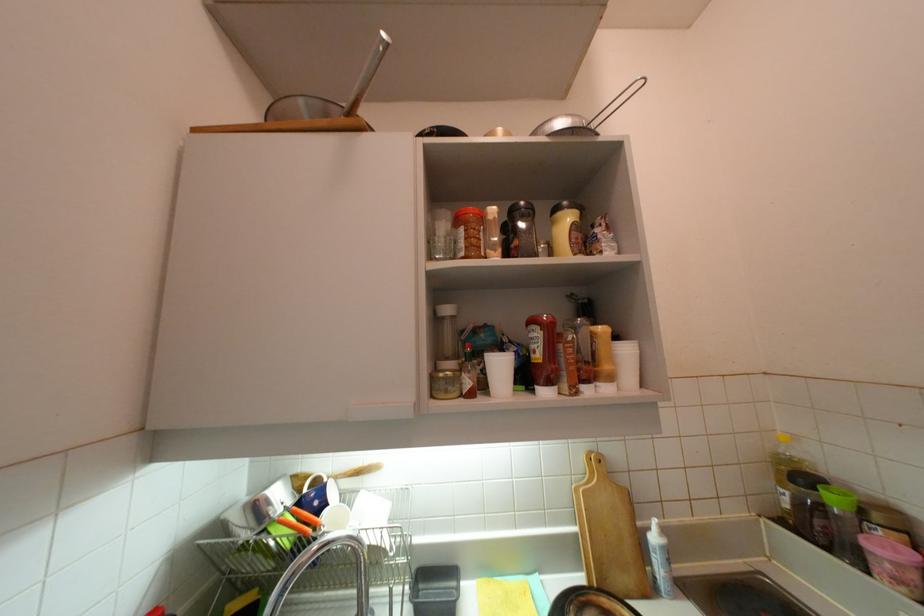
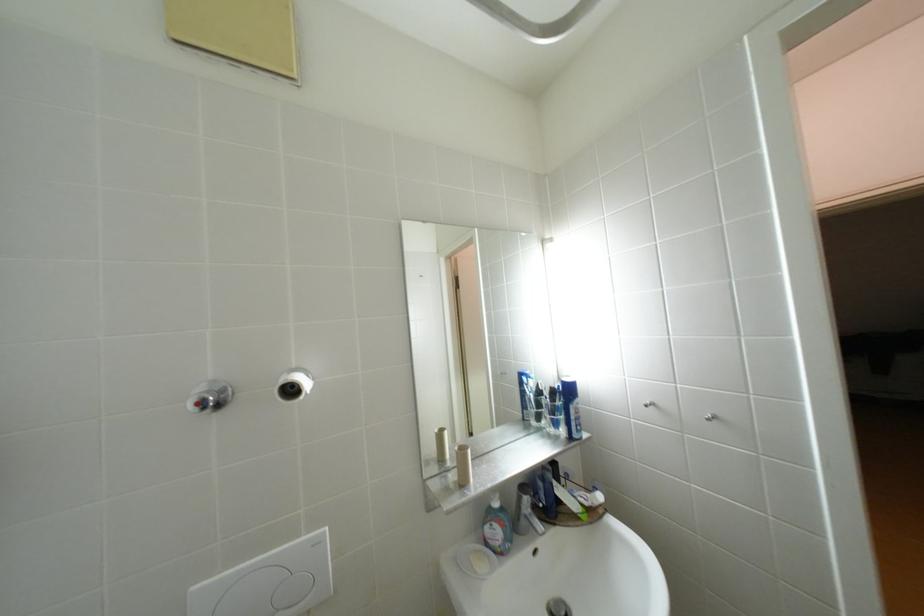
Question: The images are taken continuously from a first-person perspective. In which direction are you moving?

Choices:
 (A) Left
 (B) Right
 (C) Forward
 (D) Backward

Answer: (A)